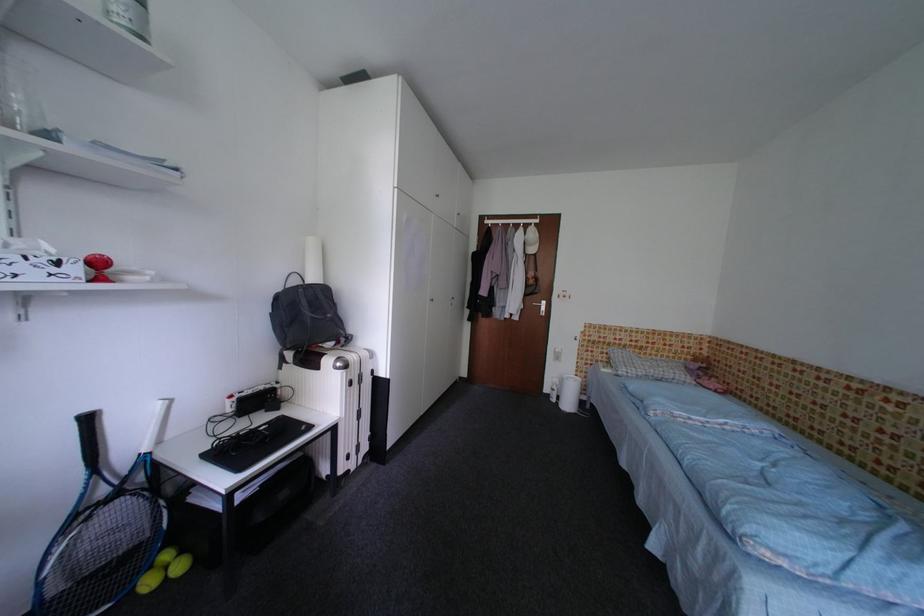
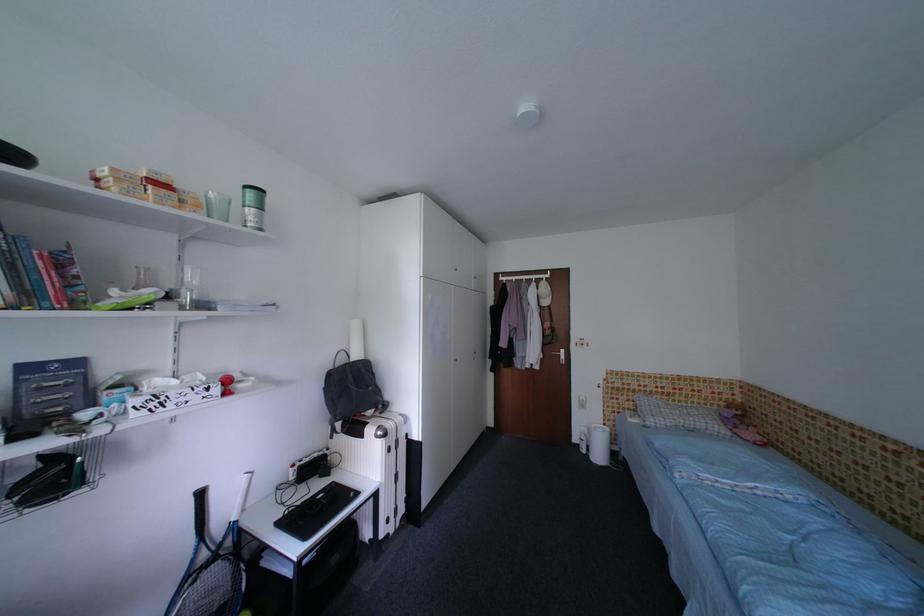
Question: Which direction would the cameraman need to move to produce the second image? Reply with the corresponding letter.

Choices:
 (A) Left
 (B) Right
 (C) Forward
 (D) Backward

Answer: (D)